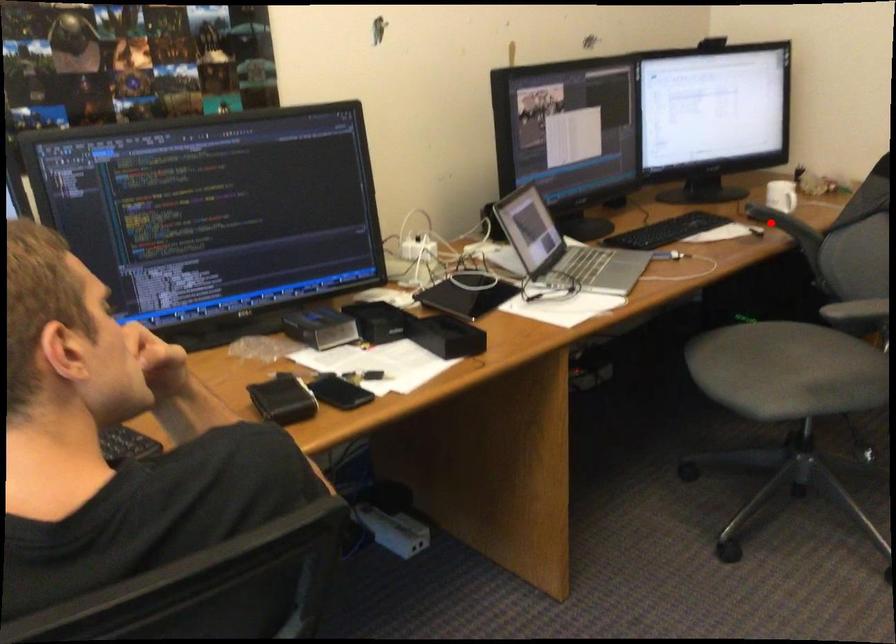
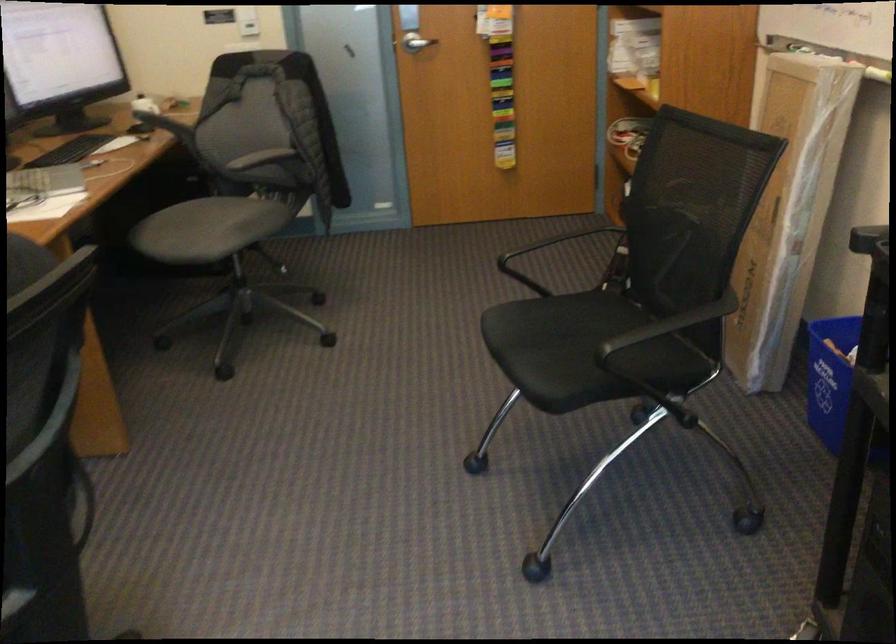
Question: I am providing you with two images of the same scene from different viewpoints. Given a red point in image1, look at the same physical point in image2. Is it:

Choices:
 (A) Closer to the viewpoint
 (B) Farther from the viewpoint

Answer: (B)